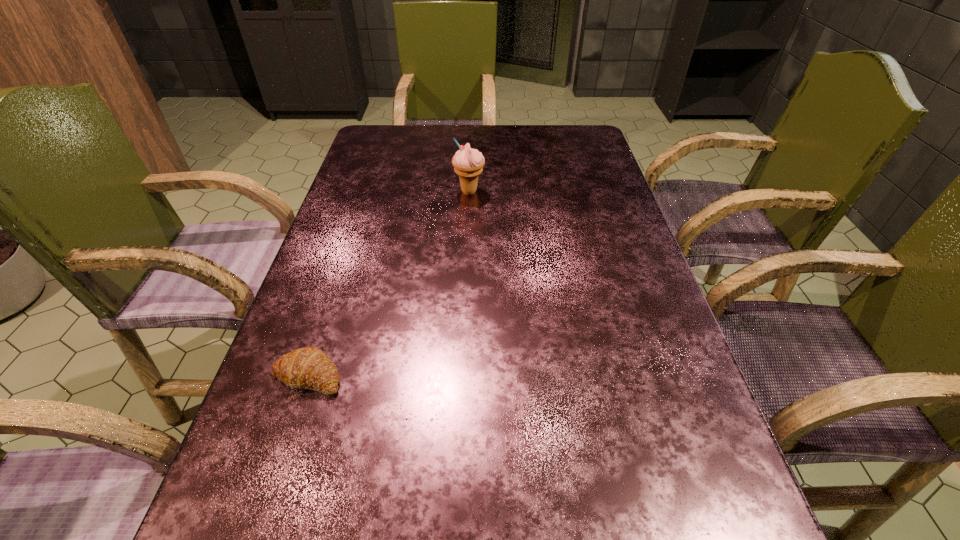
Where is `free region at the far left corner`? free region at the far left corner is located at coordinates (364, 144).

In the image, there is a desktop. Where is `vacant space at the far right corner`? vacant space at the far right corner is located at coordinates (562, 138).

At what (x,y) coordinates should I click in order to perform the action: click on free space between the left crescent roll and the icecream. Please return your answer as a coordinate pair (x, y). Looking at the image, I should click on (389, 284).

This screenshot has height=540, width=960. In order to click on unoccupied position between the icecream and the farther crescent roll in this screenshot , I will do `click(389, 284)`.

At what (x,y) coordinates should I click in order to perform the action: click on vacant area that lies between the second tallest object and the icecream. Please return your answer as a coordinate pair (x, y). Looking at the image, I should click on (389, 284).

Find the location of a particular element. The width and height of the screenshot is (960, 540). empty space between the left crescent roll and the farthest object is located at coordinates (389, 284).

Where is `the closest object to the shorter crescent roll`? The width and height of the screenshot is (960, 540). the closest object to the shorter crescent roll is located at coordinates [306, 368].

Point out which object is positioned as the second nearest to the nearer crescent roll. Please provide its 2D coordinates. Your answer should be formatted as a tuple, i.e. [(x, y)], where the tuple contains the x and y coordinates of a point satisfying the conditions above.

[(468, 163)]